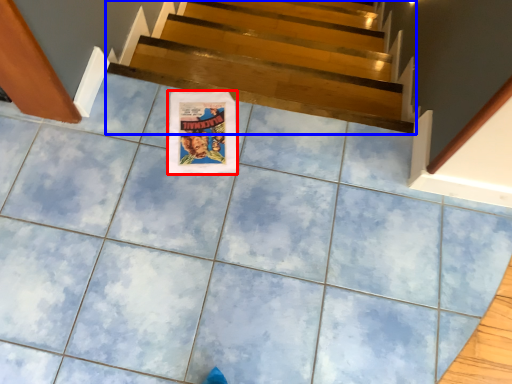
Question: Which of the following is the farthest to the observer, poster page (highlighted by a red box) or stairs (highlighted by a blue box)?

Choices:
 (A) poster page
 (B) stairs

Answer: (B)